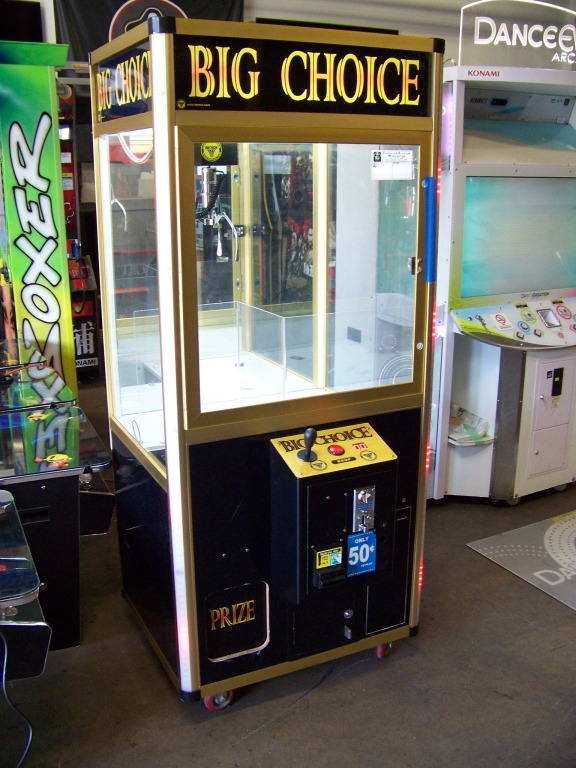
The height and width of the screenshot is (768, 576). Find the location of `floor`. floor is located at coordinates (431, 684).